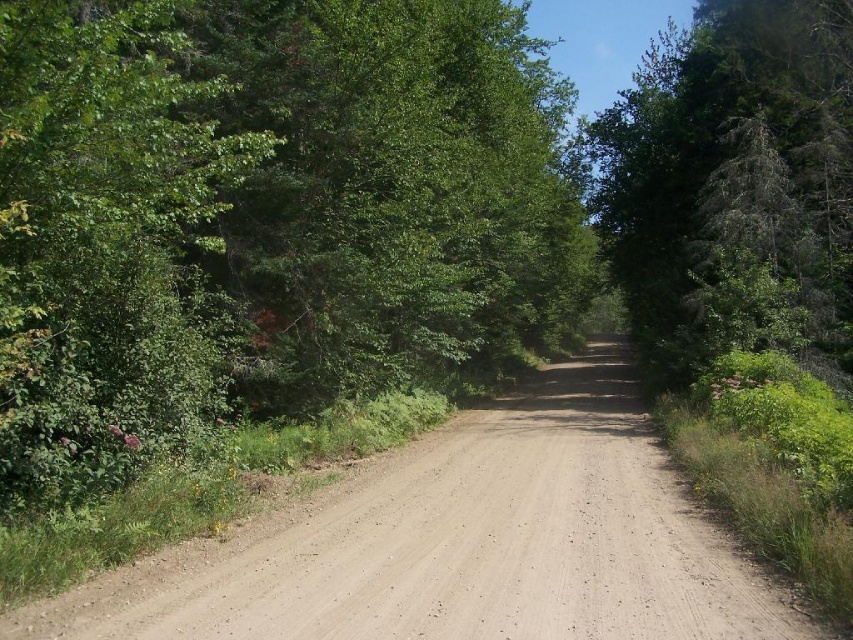
Question: Does dirt track at center come behind green textured tree at center?

Choices:
 (A) yes
 (B) no

Answer: (B)

Question: Based on their relative distances, which object is nearer to the green leafy tree at left?

Choices:
 (A) dirt track at center
 (B) green textured tree at center

Answer: (A)

Question: Which point is closer to the camera?

Choices:
 (A) (276, 513)
 (B) (349, 372)
 (C) (787, 152)

Answer: (A)

Question: In this image, where is dirt track at center located relative to green textured tree at center?

Choices:
 (A) right
 (B) left

Answer: (B)

Question: Which is nearer to the dirt track at center?

Choices:
 (A) green leafy tree at left
 (B) green textured tree at center

Answer: (A)

Question: Does green leafy tree at left have a smaller size compared to dirt track at center?

Choices:
 (A) yes
 (B) no

Answer: (B)